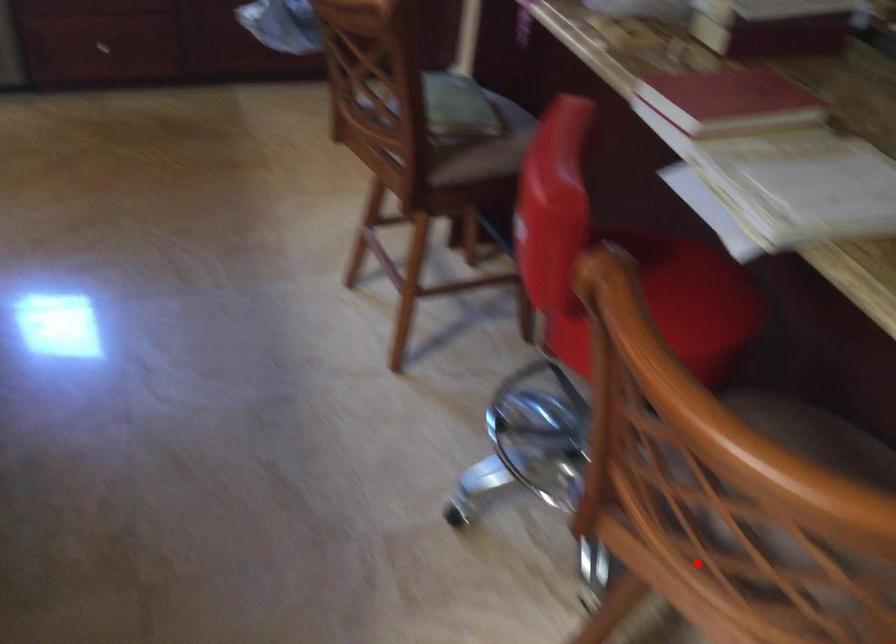
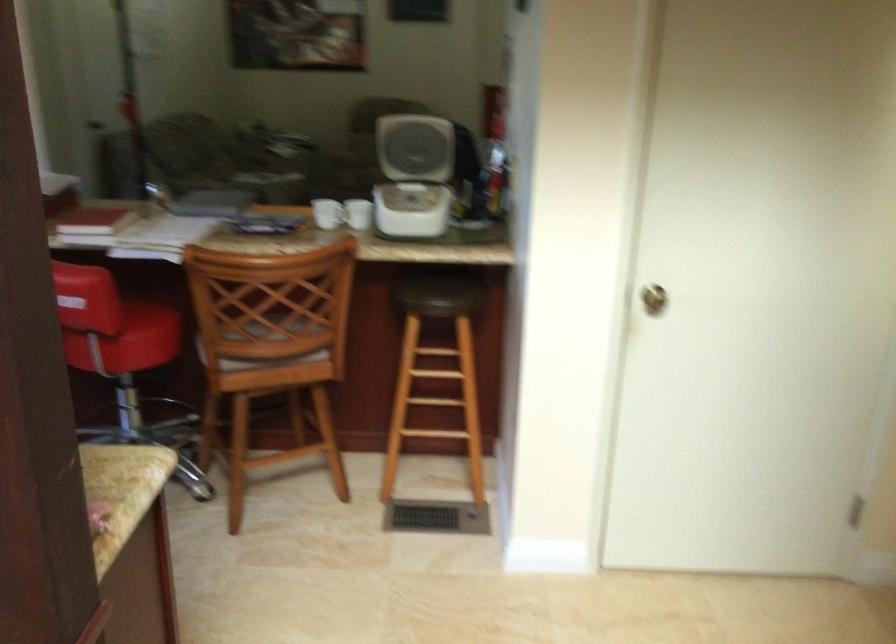
The point at the highlighted location is marked in the first image. Where is the corresponding point in the second image?

(271, 341)